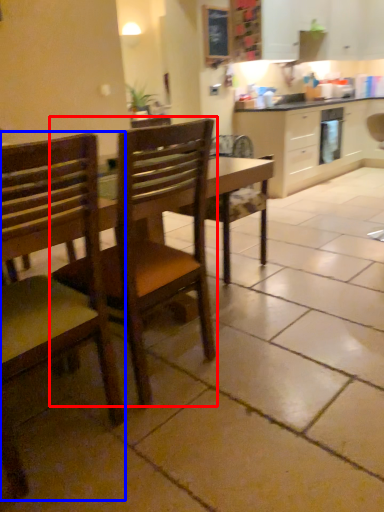
Question: Which object is closer to the camera taking this photo, chair (highlighted by a red box) or chair (highlighted by a blue box)?

Choices:
 (A) chair
 (B) chair

Answer: (B)